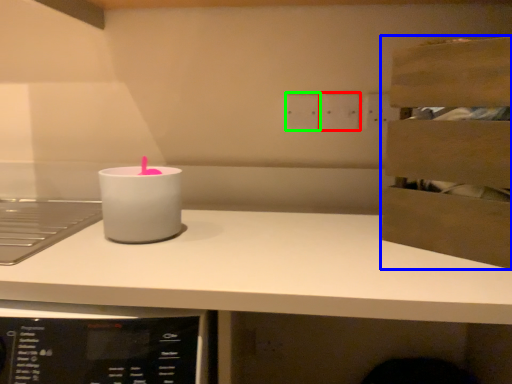
Question: Considering the real-world distances, which object is closest to electric outlet (highlighted by a red box)? cabinetry (highlighted by a blue box) or electric outlet (highlighted by a green box).

Choices:
 (A) cabinetry
 (B) electric outlet

Answer: (B)